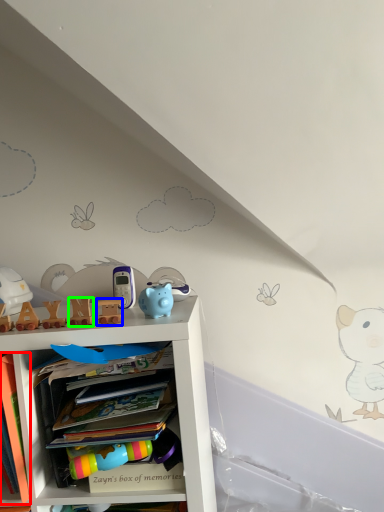
Question: Estimate the real-world distances between objects in this image. Which object is closer to book (highlighted by a red box), toy (highlighted by a blue box) or toy (highlighted by a green box)?

Choices:
 (A) toy
 (B) toy

Answer: (B)